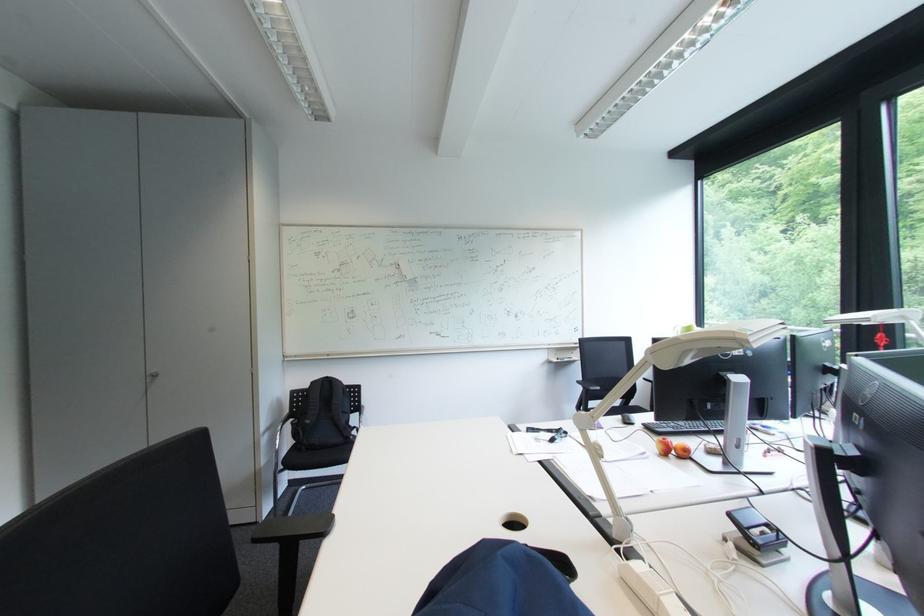
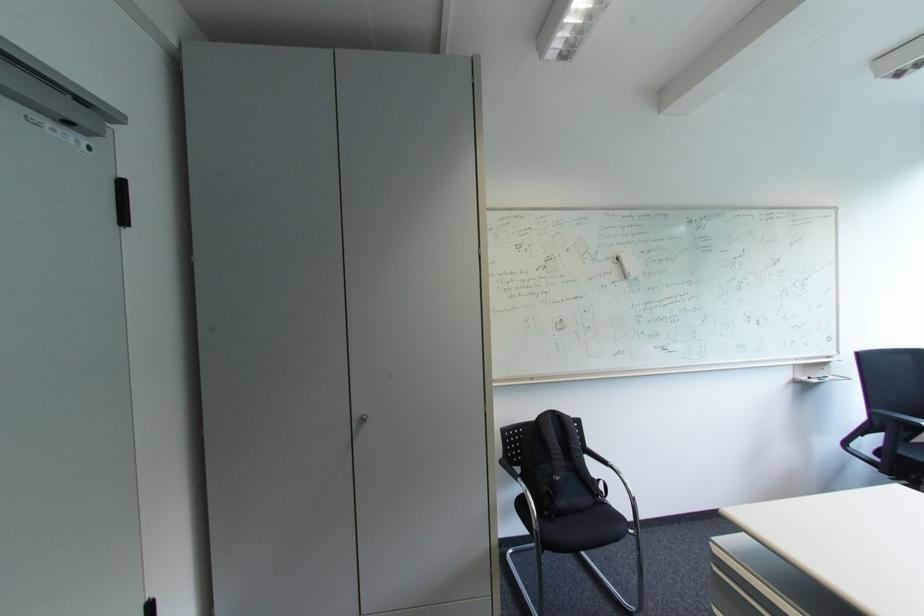
Where in the second image is the point corresponding to (x=318, y=424) from the first image?

(566, 480)